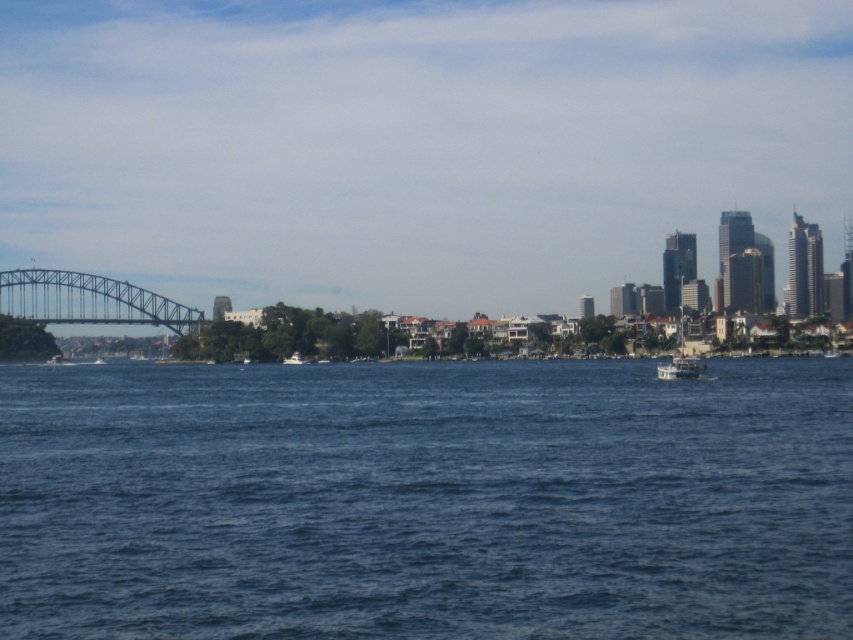
Question: Which point is closer to the camera taking this photo?

Choices:
 (A) (276, 630)
 (B) (665, 365)

Answer: (A)

Question: Can you confirm if blue water at center is bigger than white plastic boat at center?

Choices:
 (A) yes
 (B) no

Answer: (A)

Question: Which object appears farthest from the camera in this image?

Choices:
 (A) white glossy boat at center
 (B) metallic steel bridge at left
 (C) white plastic boat at center
 (D) blue water at center

Answer: (B)

Question: Which object is closer to the camera taking this photo?

Choices:
 (A) white glossy boat at center
 (B) blue water at center
 (C) metallic steel bridge at left
 (D) white plastic boat at center

Answer: (B)

Question: Does metallic steel bridge at left have a larger size compared to white glossy boat at center?

Choices:
 (A) no
 (B) yes

Answer: (B)

Question: Can you confirm if metallic steel bridge at left is positioned to the right of white glossy boat at center?

Choices:
 (A) yes
 (B) no

Answer: (B)